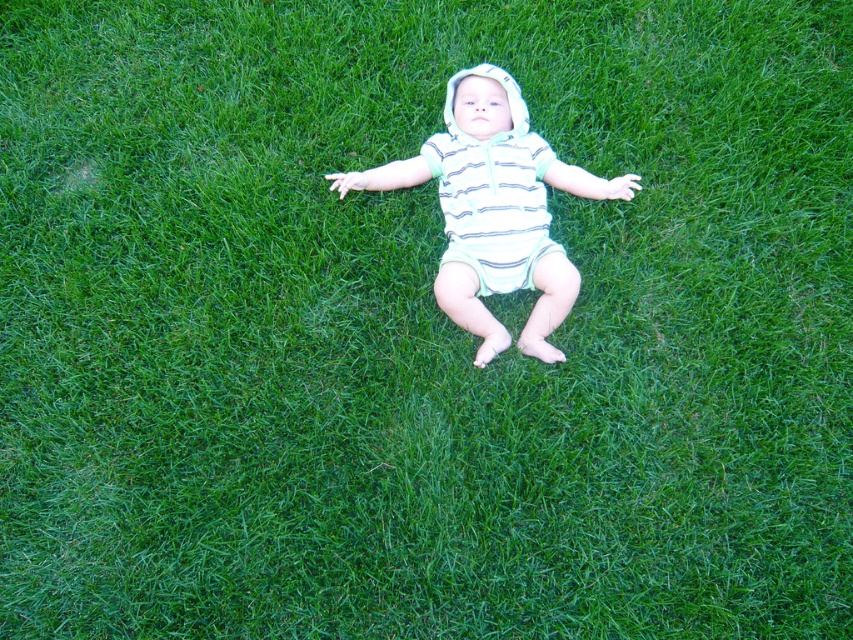
Can you confirm if striped cotton onesie at center is shorter than striped cotton diaper at center?

In fact, striped cotton onesie at center may be taller than striped cotton diaper at center.

From the picture: Who is more distant from viewer, (x=369, y=188) or (x=444, y=262)?

The point (x=369, y=188) is more distant.

You are a GUI agent. You are given a task and a screenshot of the screen. Output one action in this format:
    pyautogui.click(x=<x>, y=<y>)
    Task: Click on the striped cotton onesie at center
    The height and width of the screenshot is (640, 853).
    Given the screenshot: What is the action you would take?
    pyautogui.click(x=494, y=209)